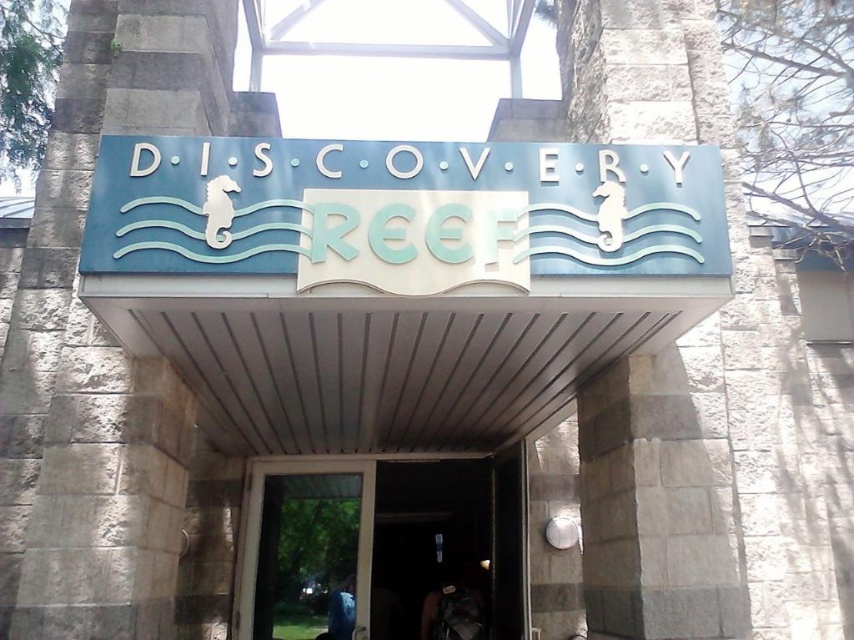
Who is taller, blue painted metal sign at center or transparent glass door at center?

Standing taller between the two is transparent glass door at center.

Between blue painted metal sign at center and transparent glass door at center, which one is positioned higher?

blue painted metal sign at center is higher up.

Is point (646, 212) more distant than point (487, 464)?

No, it is in front of (487, 464).

Image resolution: width=854 pixels, height=640 pixels. I want to click on blue painted metal sign at center, so pyautogui.click(x=402, y=211).